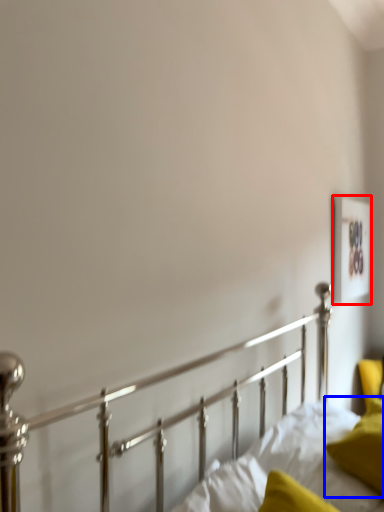
Question: Which of the following is the closest to the observer, picture frame (highlighted by a red box) or pillow (highlighted by a blue box)?

Choices:
 (A) picture frame
 (B) pillow

Answer: (B)